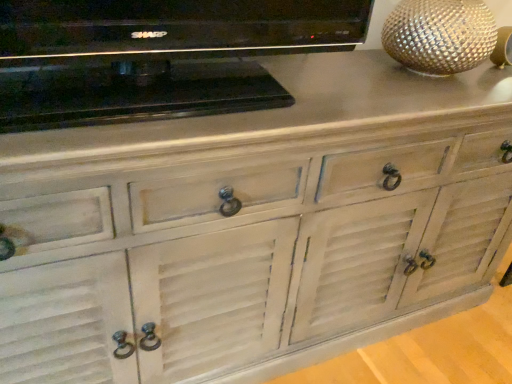
Identify the location of vacant position to the left of gold textured sphere at upper right. Image resolution: width=512 pixels, height=384 pixels. (336, 73).